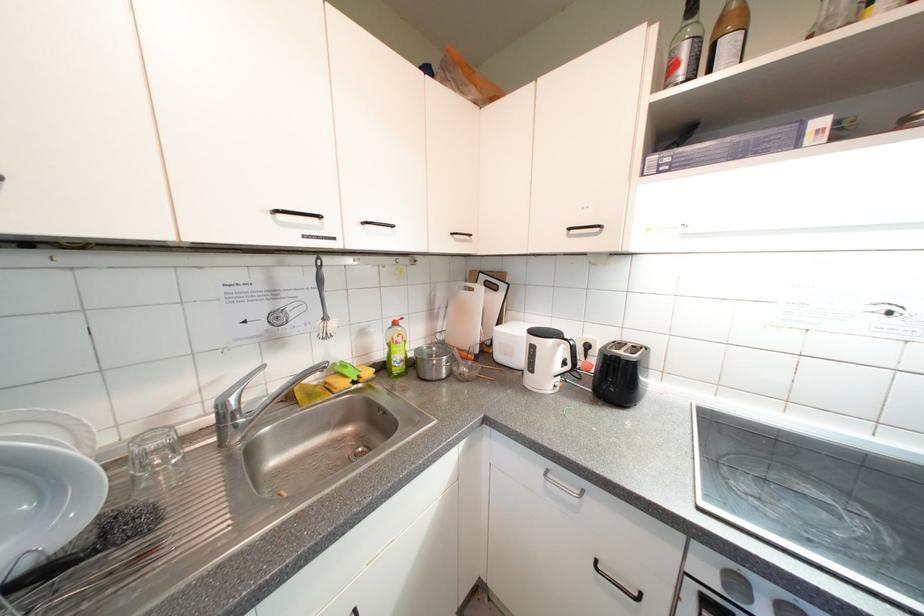
The location [322,305] corresponds to which object?

It refers to a black cleaning brush.